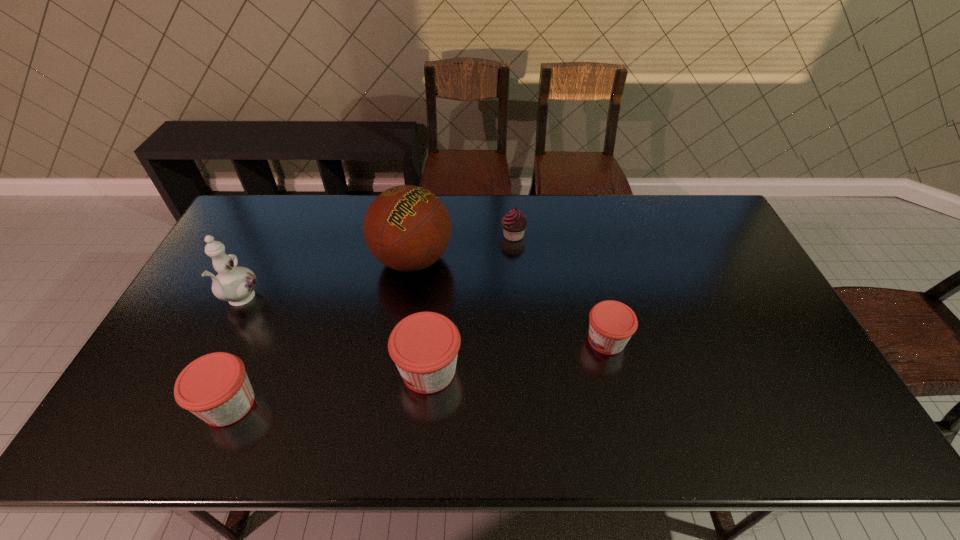
Image resolution: width=960 pixels, height=540 pixels. What are the coordinates of `vacant space situated on the front label of the second jam from right to left` in the screenshot? It's located at (357, 370).

Find the location of a particular element. The width and height of the screenshot is (960, 540). vacant space located 0.190m on the front label of the second jam from right to left is located at coordinates (323, 370).

Find the location of `vacant space positioned on the front label of the second jam from right to left`. vacant space positioned on the front label of the second jam from right to left is located at coordinates (269, 370).

Identify the location of free point located 0.050m on the front label of the rightmost jam. The image size is (960, 540). (565, 340).

Image resolution: width=960 pixels, height=540 pixels. I want to click on vacant space located on the front label of the rightmost jam, so click(493, 340).

The image size is (960, 540). I want to click on vacant region located 0.280m on the front label of the rightmost jam, so click(482, 340).

The height and width of the screenshot is (540, 960). In order to click on free spot located 0.100m on the left of the basketball in this screenshot , I will do `click(342, 260)`.

Find the location of a particular element. This screenshot has height=540, width=960. vacant space located at the spout of the chinaware is located at coordinates (194, 393).

Image resolution: width=960 pixels, height=540 pixels. Identify the location of free space located 0.330m on the right of the cupcake. (622, 235).

Locate an element on the screen. The height and width of the screenshot is (540, 960). basketball present at the far edge is located at coordinates (407, 228).